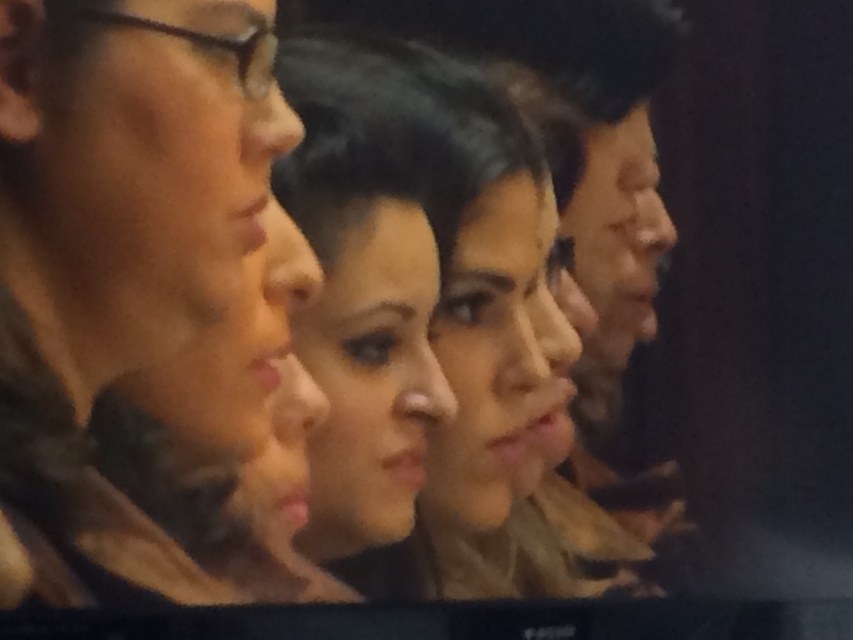
You are a photographer adjusting the focus of your camera. The camera is currently focused on the point at the center of the image. There is a person with matte brown hair at center located at point (151, 304). Do you need to adjust the focus to capture the matte brown hair at center clearly?

The matte brown hair at center is located at point (151, 304), which is the current focus point of the camera. Therefore, no adjustment is needed to capture the matte brown hair at center clearly.

You are a photographer trying to adjust the lighting to focus on the matte brown hair at center and the smooth brown hair at center. Which hair should you adjust the lighting to highlight first to ensure both are visible?

The matte brown hair at center is in front of smooth brown hair at center, so you should adjust the lighting to highlight the matte brown hair at center first to prevent it from blocking the smooth brown hair at center.

You are a photographer adjusting lighting for a group photo. You notice two individuals with hair at the center of the image. The first has matte brown hair at center, and the second has smooth brown hair at center. Which of these two has narrower hair?

The matte brown hair at center has a narrower width compared to the smooth brown hair at center, as stated in the description.